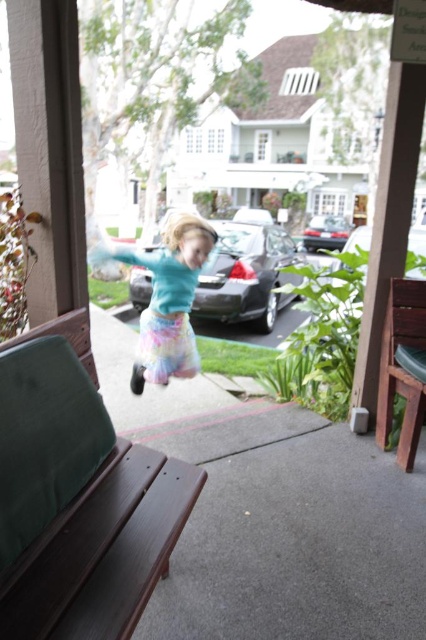
What do you see at coordinates (77, 504) in the screenshot?
I see `wooden park bench at lower left` at bounding box center [77, 504].

Can you confirm if wooden park bench at lower left is positioned to the left of shiny black car at center?

Yes, wooden park bench at lower left is to the left of shiny black car at center.

Between point (74, 458) and point (331, 221), which one is positioned behind?

Positioned behind is point (331, 221).

Locate an element on the screen. wooden park bench at lower left is located at coordinates (77, 504).

Does point (386, 314) come farther from viewer compared to point (192, 365)?

No, (386, 314) is closer to viewer.

Can you confirm if wooden park bench at right is positioned below pastel cotton ballet skirt at center?

Correct, wooden park bench at right is located below pastel cotton ballet skirt at center.

You are a GUI agent. You are given a task and a screenshot of the screen. Output one action in this format:
    pyautogui.click(x=<x>, y=<y>)
    Task: Click on the wooden park bench at right
    The width and height of the screenshot is (426, 640).
    Given the screenshot: What is the action you would take?
    pyautogui.click(x=402, y=368)

This screenshot has height=640, width=426. Find the location of `wooden park bench at right`. wooden park bench at right is located at coordinates (402, 368).

Is point (169, 275) positioned before point (330, 246)?

Yes, it is in front of point (330, 246).

Who is more distant from viewer, (186,257) or (336,230)?

The point (336,230) is more distant.

Does point (172, 276) come farther from viewer compared to point (324, 243)?

That is False.

You are a GUI agent. You are given a task and a screenshot of the screen. Output one action in this format:
    pyautogui.click(x=<x>, y=<y>)
    Task: Click on the pastel tie-dye skirt at center
    Image resolution: width=426 pixels, height=640 pixels.
    Given the screenshot: What is the action you would take?
    click(x=166, y=298)